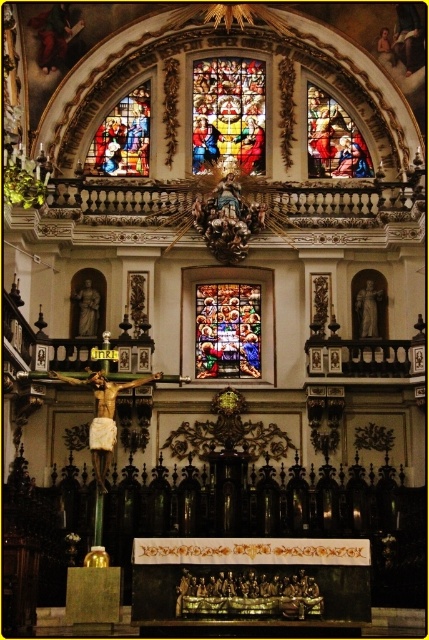
Question: Is the position of multicolored stained glass at center more distant than that of stained glass window at upper left?

Choices:
 (A) no
 (B) yes

Answer: (A)

Question: Does multicolored stained glass at center have a lesser width compared to stained glass window at upper left?

Choices:
 (A) no
 (B) yes

Answer: (A)

Question: Which object is positioned closest to the multicolored stained glass at center?

Choices:
 (A) stained glass at center
 (B) stained glass window at upper left
 (C) stained glass window at upper center

Answer: (B)

Question: Among these objects, which one is farthest from the camera?

Choices:
 (A) multicolored stained glass at center
 (B) stained glass window at upper left

Answer: (B)

Question: Is multicolored stained glass at center bigger than stained glass at center?

Choices:
 (A) yes
 (B) no

Answer: (A)

Question: Which object appears closest to the camera in this image?

Choices:
 (A) stained glass window at upper center
 (B) stained glass at center
 (C) stained glass window at upper left
 (D) multicolored stained glass at center

Answer: (B)